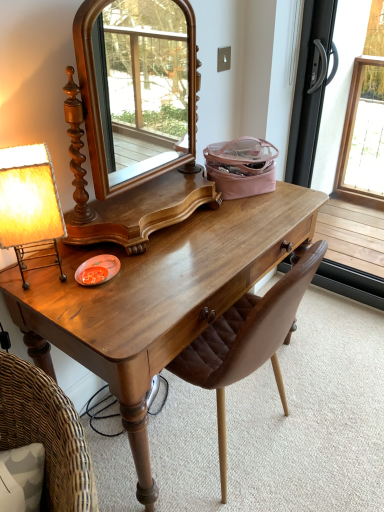
You are a GUI agent. You are given a task and a screenshot of the screen. Output one action in this format:
    pyautogui.click(x=<x>, y=<y>)
    Task: Click on the free space above shiny brown wooden desk at center (from a real-world perspective)
    This screenshot has height=512, width=384.
    Given the screenshot: What is the action you would take?
    pyautogui.click(x=169, y=253)